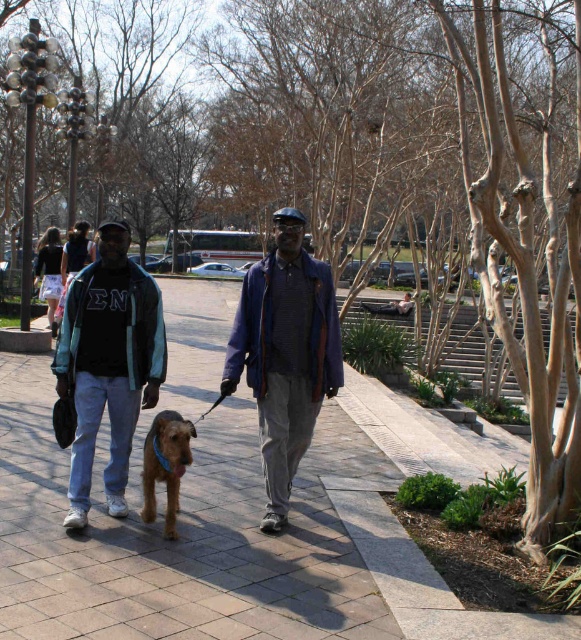
Question: Is brown furry dog at center to the left of black cotton jacket at center from the viewer's perspective?

Choices:
 (A) yes
 (B) no

Answer: (B)

Question: Which object is closer to the camera taking this photo?

Choices:
 (A) brown furry dog at center
 (B) dark blue woolen jacket at center

Answer: (A)

Question: Estimate the real-world distances between objects in this image. Which object is closer to the dark blue woolen jacket at center?

Choices:
 (A) matte black jacket at left
 (B) black cotton jacket at center
 (C) brown furry dog at center

Answer: (C)

Question: Does dark blue woolen jacket at center have a larger size compared to matte black jacket at left?

Choices:
 (A) yes
 (B) no

Answer: (A)

Question: Based on their relative distances, which object is farther from the matte black jacket at left?

Choices:
 (A) black cotton jacket at center
 (B) dark blue woolen jacket at center
 (C) brown furry dog at center

Answer: (A)

Question: Is dark blue woolen jacket at center to the right of black cotton jacket at center from the viewer's perspective?

Choices:
 (A) no
 (B) yes

Answer: (B)